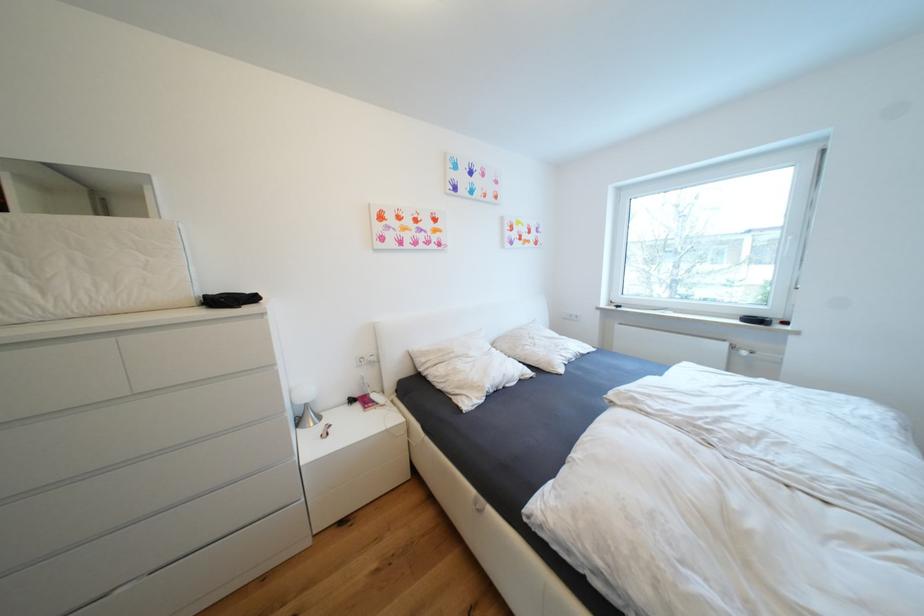
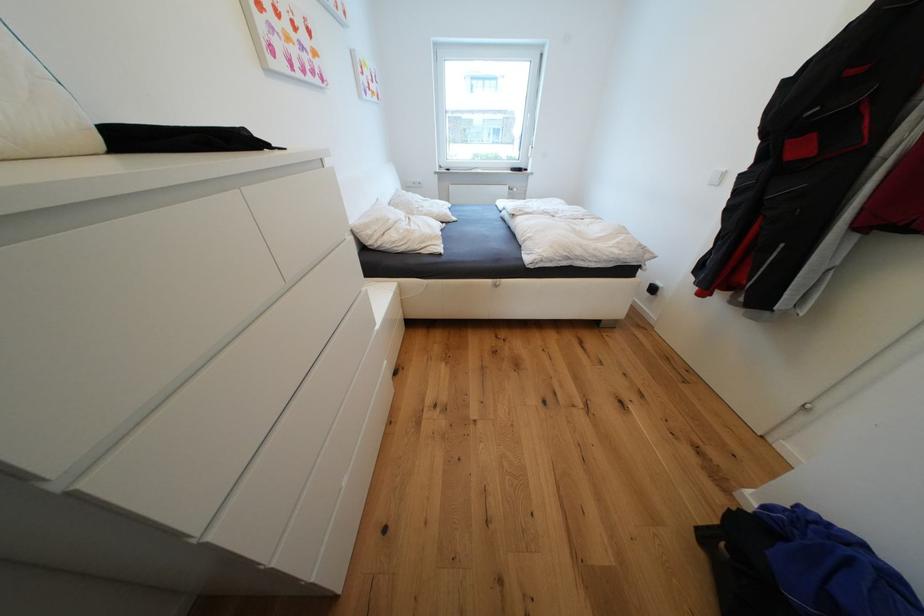
Find the pixel in the second image that matches pixel 733 346 in the first image.

(515, 188)